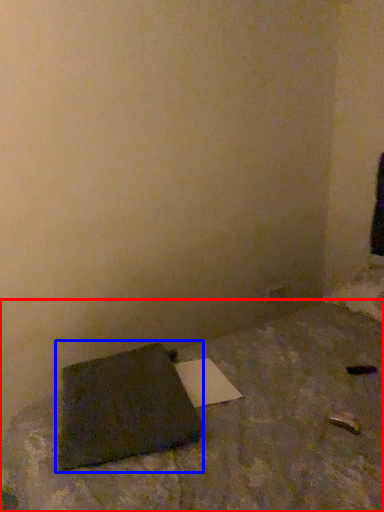
Question: Among these objects, which one is nearest to the camera, furniture (highlighted by a red box) or notebook (highlighted by a blue box)?

Choices:
 (A) furniture
 (B) notebook

Answer: (A)